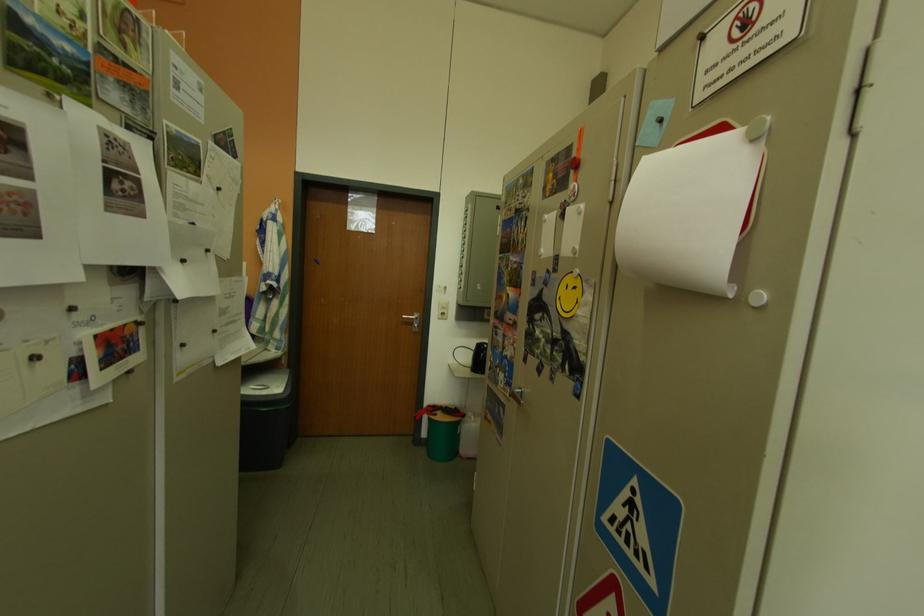
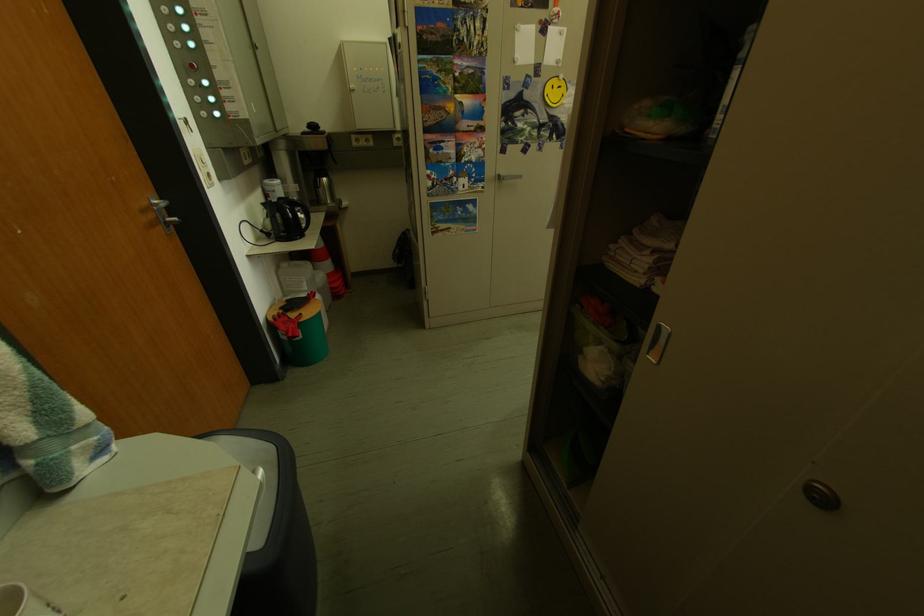
The point at (565, 278) is marked in the first image. Where is the corresponding point in the second image?

(546, 82)